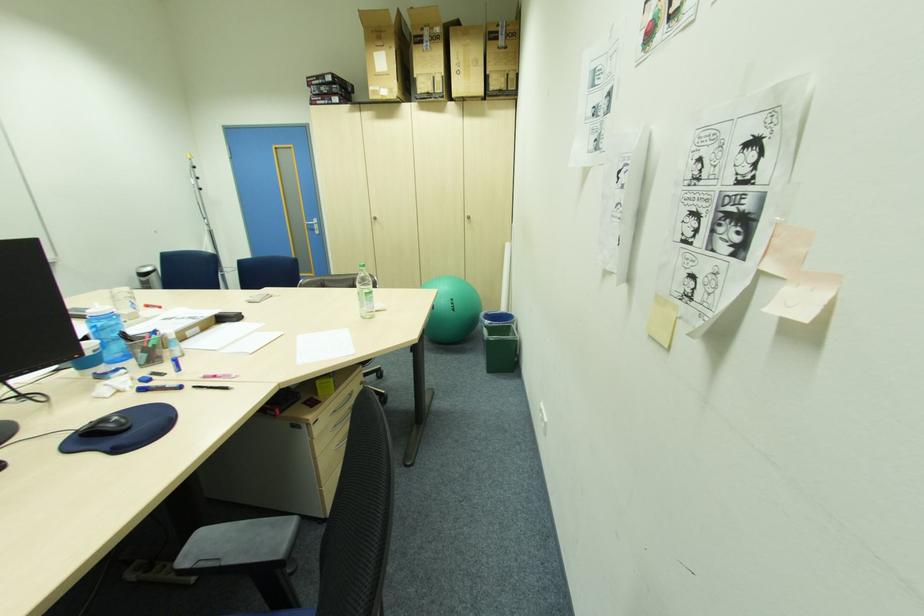
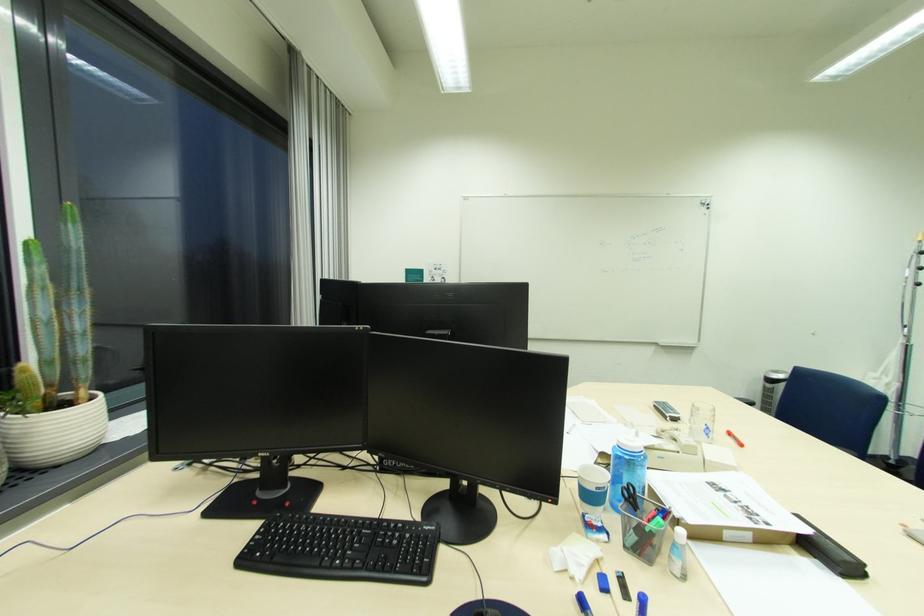
Where in the second image is the point corresponding to (x=171, y=375) from the first image?

(636, 601)